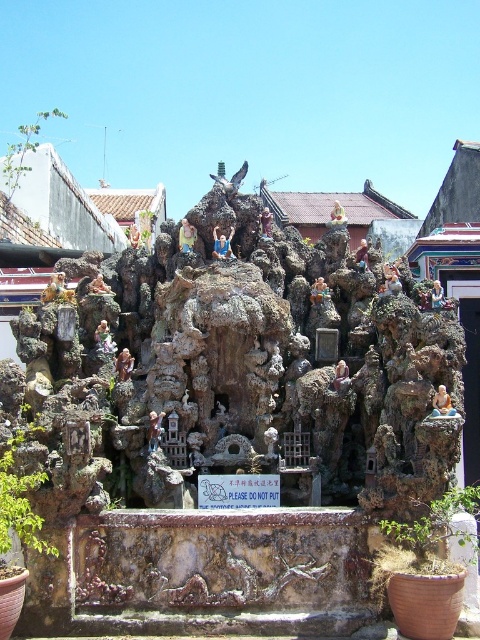
Can you confirm if rusty stone sculpture at center is taller than matte gold statue at center?

Indeed, rusty stone sculpture at center has a greater height compared to matte gold statue at center.

Is rusty stone sculpture at center to the right of matte gold statue at center from the viewer's perspective?

Indeed, rusty stone sculpture at center is positioned on the right side of matte gold statue at center.

Does point (148, 403) come behind point (184, 244)?

No, (148, 403) is in front of (184, 244).

Find the location of a particular element. rusty stone sculpture at center is located at coordinates (245, 369).